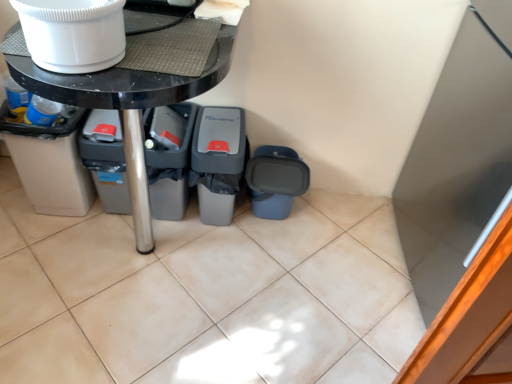
This screenshot has width=512, height=384. What are the coordinates of `free region under black glossy table at center (from a real-world perspective)` in the screenshot? It's located at (145, 258).